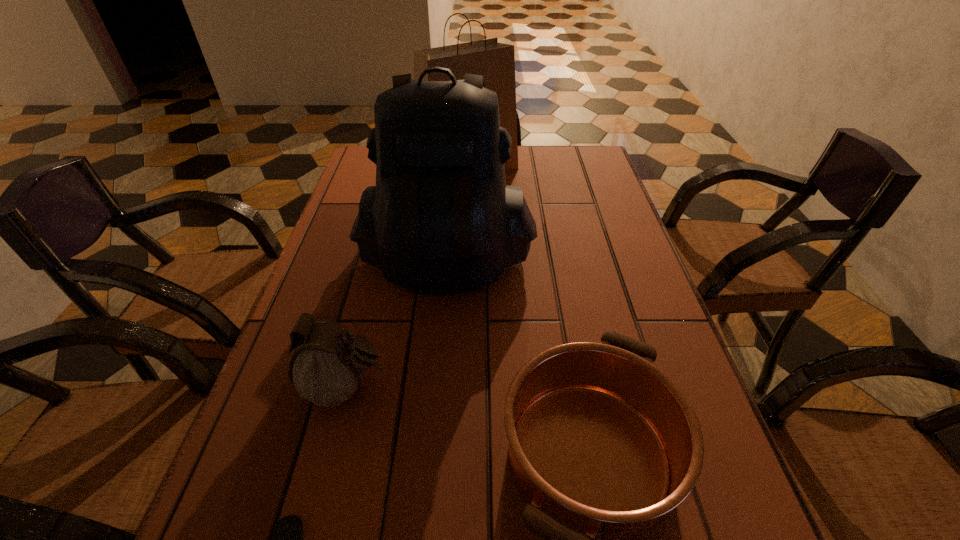
This screenshot has height=540, width=960. In order to click on the farthest object in this screenshot , I will do `click(496, 61)`.

Locate an element on the screen. The height and width of the screenshot is (540, 960). backpack is located at coordinates (441, 220).

Find the location of a particular element. pouch is located at coordinates (327, 367).

What are the coordinates of `free space located on the left of the shopping bag` in the screenshot? It's located at (377, 172).

Image resolution: width=960 pixels, height=540 pixels. In order to click on vacant space situated at the front pocket of the backpack in this screenshot , I will do `click(427, 464)`.

Identify the location of free location located 0.350m on the front-facing side of the pouch. The image size is (960, 540). (583, 388).

Find the location of a particular element. object situated at the far edge is located at coordinates (496, 61).

Image resolution: width=960 pixels, height=540 pixels. I want to click on backpack that is at the left edge, so click(x=441, y=220).

Identify the location of pouch situated at the left edge. (327, 367).

Where is `vacant area at the left edge`? The image size is (960, 540). vacant area at the left edge is located at coordinates [x=348, y=268].